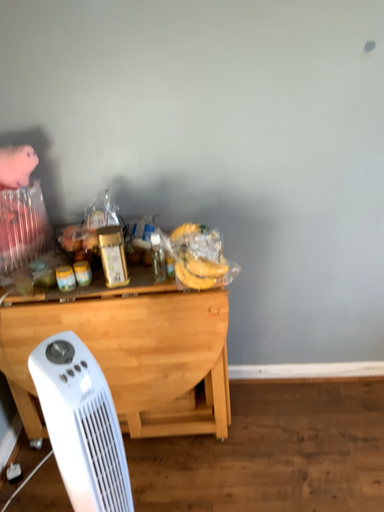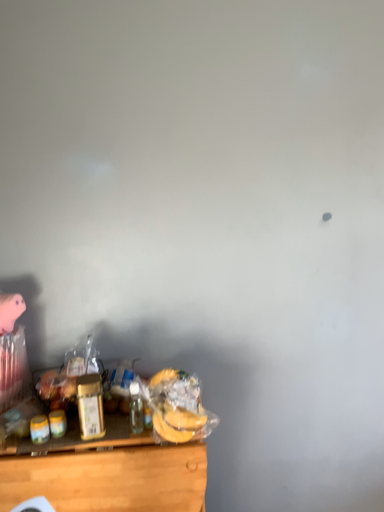
Question: Which way did the camera rotate in the video?

Choices:
 (A) rotated upward
 (B) rotated downward

Answer: (A)